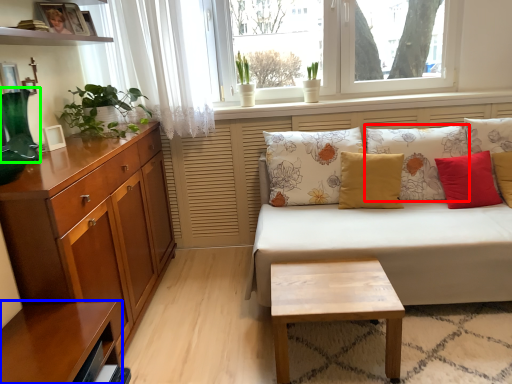
Question: Based on their relative distances, which object is nearer to pillow (highlighted by a red box)? Choose from shelf (highlighted by a blue box) and vase (highlighted by a green box).

Choices:
 (A) shelf
 (B) vase

Answer: (A)